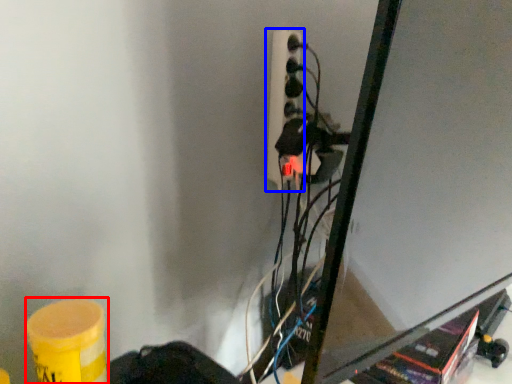
Question: Which of the following is the closest to the observer, barrel (highlighted by a red box) or power plugs and sockets (highlighted by a blue box)?

Choices:
 (A) barrel
 (B) power plugs and sockets

Answer: (A)